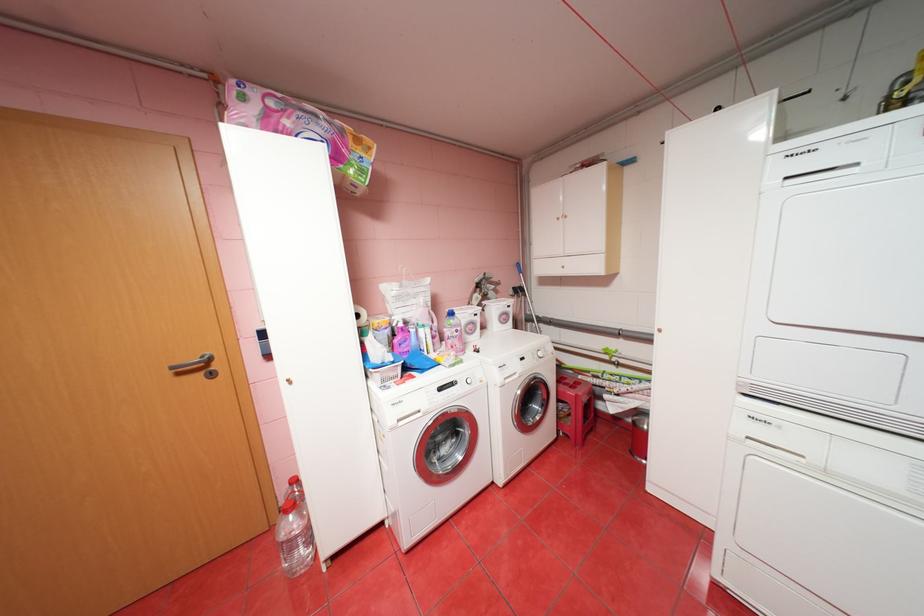
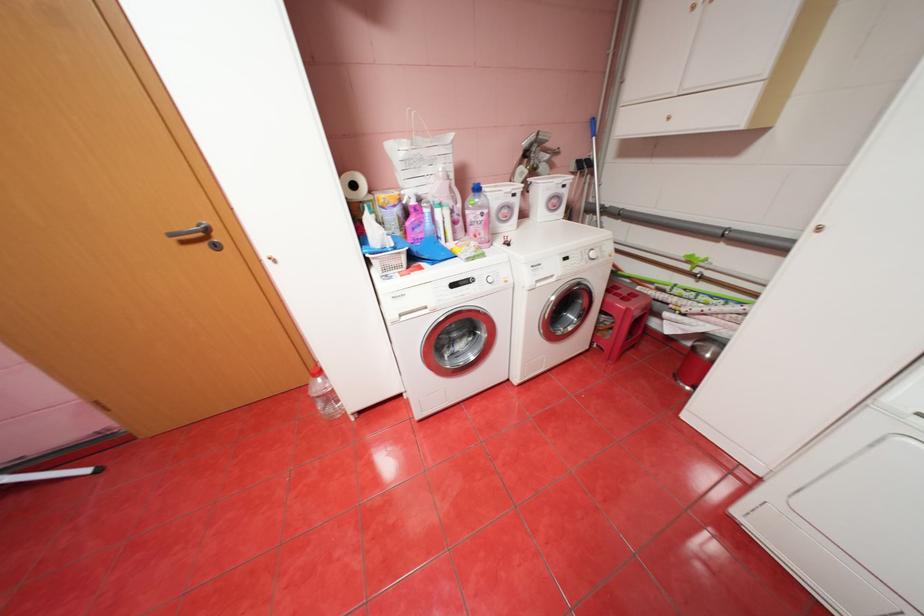
In a continuous first-person perspective shot, in which direction is the camera moving?

The cameraman walked toward right, forward.